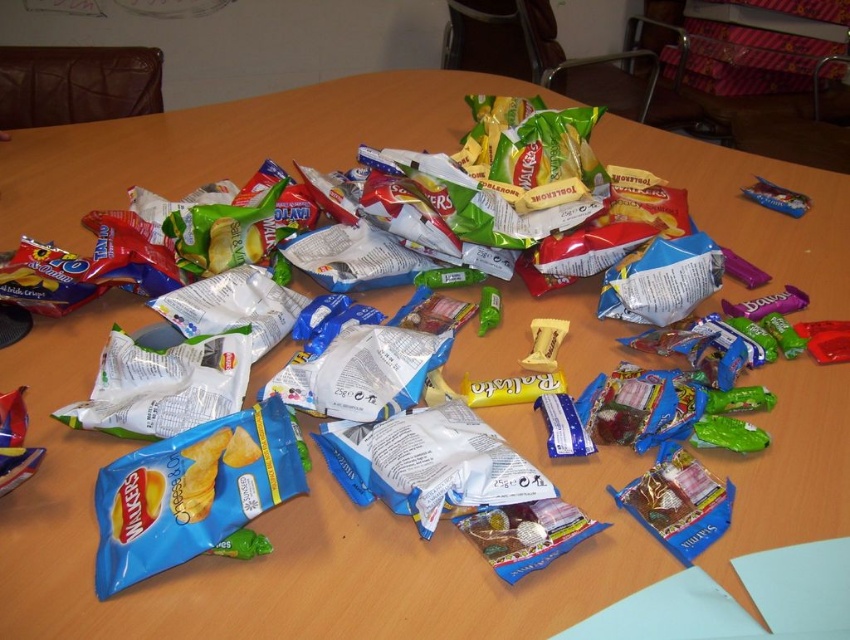
Describe the element at coordinates (191, 492) in the screenshot. I see `blue matte chip bag at lower left` at that location.

Can you confirm if blue matte chip bag at lower left is positioned above green rubber toy at center?

No.

At what (x,y) coordinates should I click in order to perform the action: click on blue matte chip bag at lower left. Please return your answer as a coordinate pair (x, y). The image size is (850, 640). Looking at the image, I should click on (191, 492).